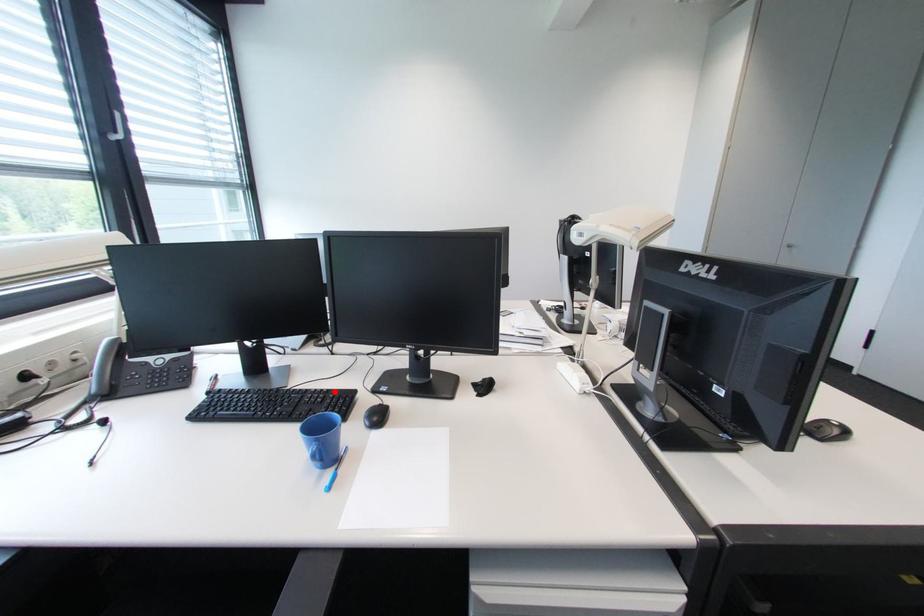
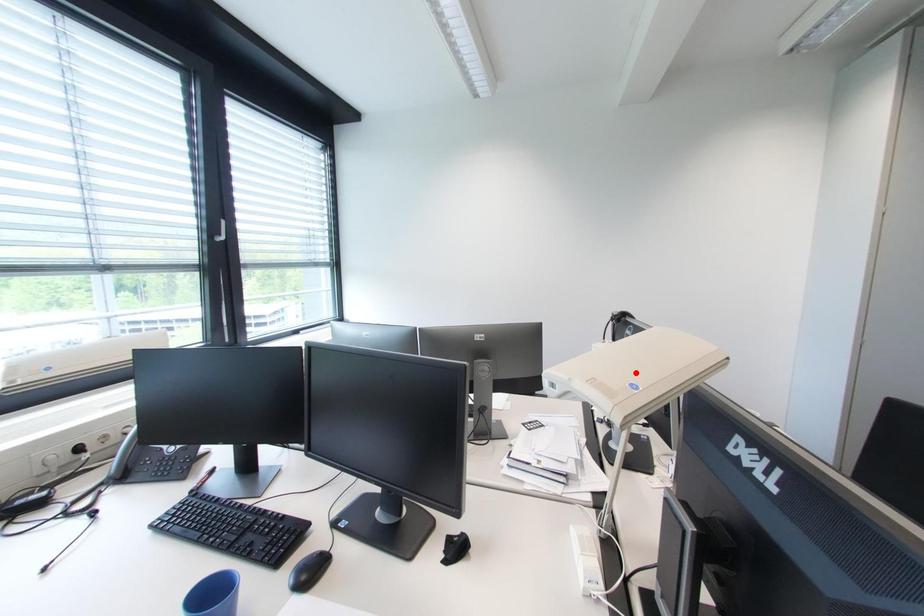
I am providing you with two images of the same scene from different viewpoints. A red point is marked on the first image and another point is marked on the second image. Do the highlighted points in image1 and image2 indicate the same real-world spot?

No